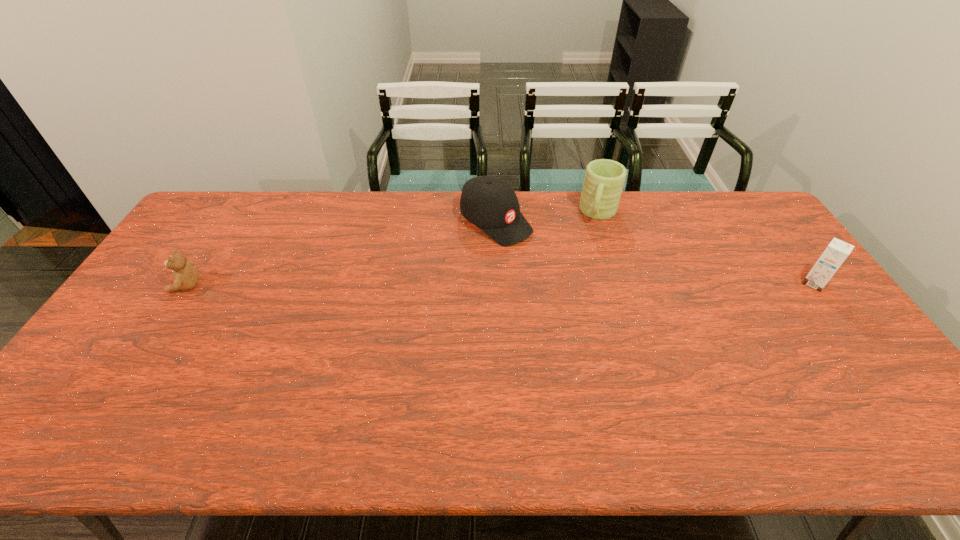
Find the location of `vacant spot on the desktop that is between the leftmost object and the rightmost object and is positioned with a logo on the front of the second object from left to right`. vacant spot on the desktop that is between the leftmost object and the rightmost object and is positioned with a logo on the front of the second object from left to right is located at coordinates (585, 284).

The image size is (960, 540). In order to click on free spot on the desktop that is between the leftmost object and the chocolate milk and is positioned on the side of the second object from right to left with the handle in this screenshot , I will do `click(575, 284)`.